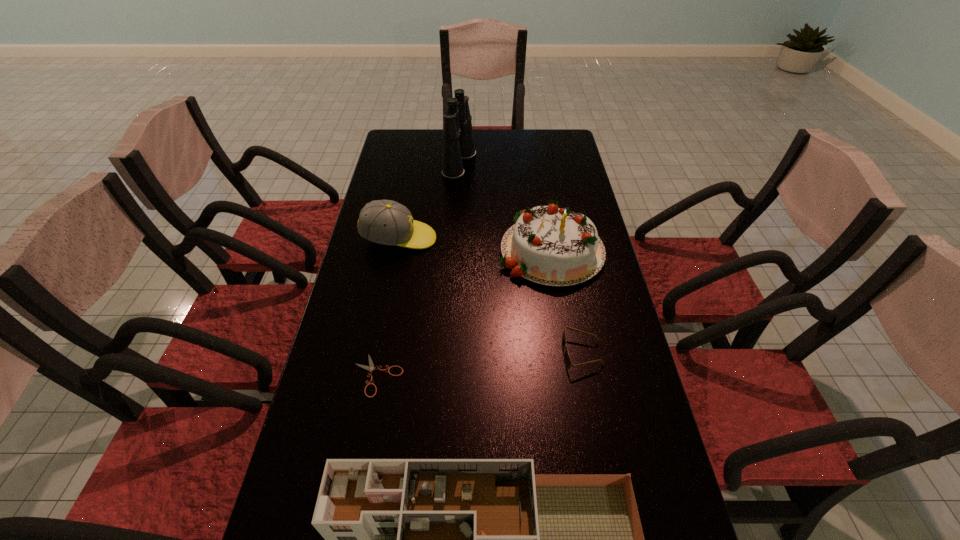
Where is `vacant region located 0.160m on the frames of the sunglasses`? The image size is (960, 540). vacant region located 0.160m on the frames of the sunglasses is located at coordinates (498, 354).

At what (x,y) coordinates should I click in order to perform the action: click on vacant space situated 0.400m on the frames of the sunglasses. Please return your answer as a coordinate pair (x, y). Looking at the image, I should click on (401, 354).

Image resolution: width=960 pixels, height=540 pixels. Identify the location of free space located 0.050m on the left of the shears. (331, 375).

At what (x,y) coordinates should I click in order to perform the action: click on object that is at the far edge. Please return your answer as a coordinate pair (x, y). Looking at the image, I should click on (458, 142).

Identify the location of baseball cap that is at the left edge. (386, 222).

Where is `shears that is at the left edge`? This screenshot has width=960, height=540. shears that is at the left edge is located at coordinates (370, 368).

You are a GUI agent. You are given a task and a screenshot of the screen. Output one action in this format:
    pyautogui.click(x=<x>, y=<y>)
    Task: Click on the cake situated at the right edge
    The height and width of the screenshot is (540, 960).
    Given the screenshot: What is the action you would take?
    pyautogui.click(x=547, y=245)

Locate an element on the screen. sunglasses located in the right edge section of the desktop is located at coordinates (567, 360).

Identify the location of vacant area at the far edge. (477, 151).

Locate an element on the screen. free point at the left edge is located at coordinates (373, 343).